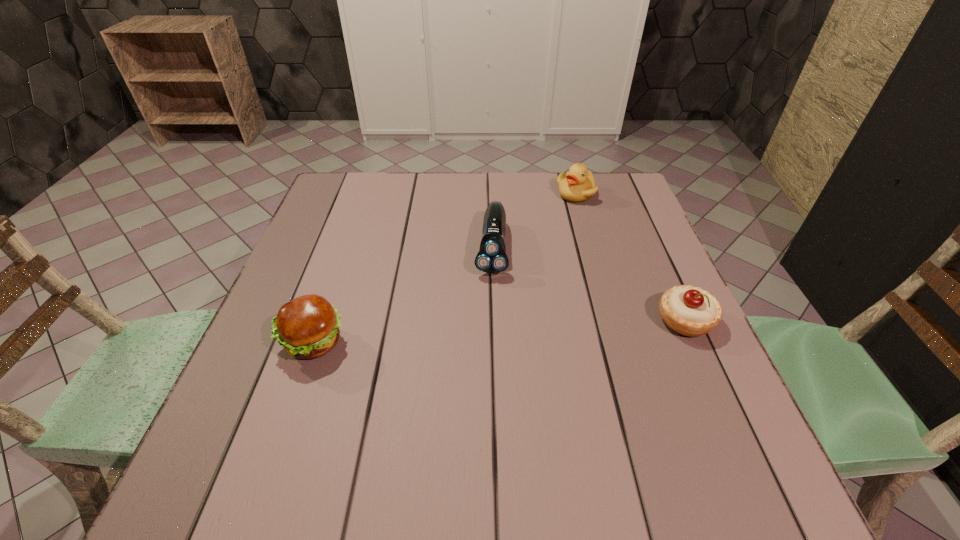
Find the location of `vacant point located between the leftmost object and the rightmost object`. vacant point located between the leftmost object and the rightmost object is located at coordinates (499, 332).

Where is `free spot between the rightmost object and the second object from left to right`? Image resolution: width=960 pixels, height=540 pixels. free spot between the rightmost object and the second object from left to right is located at coordinates (588, 284).

What are the coordinates of `free point between the second object from right to left and the third nearest object` in the screenshot? It's located at (533, 221).

The height and width of the screenshot is (540, 960). I want to click on vacant area that lies between the third object from right to left and the farthest object, so click(x=533, y=221).

Where is `vacant space that's between the leftmost object and the rightmost object`? This screenshot has height=540, width=960. vacant space that's between the leftmost object and the rightmost object is located at coordinates (499, 332).

Locate which object is the closest to the leftmost object. Please provide its 2D coordinates. Your answer should be formatted as a tuple, i.e. [(x, y)], where the tuple contains the x and y coordinates of a point satisfying the conditions above.

[(492, 258)]

Identify which object is the second closest to the rightmost object. Please provide its 2D coordinates. Your answer should be formatted as a tuple, i.e. [(x, y)], where the tuple contains the x and y coordinates of a point satisfying the conditions above.

[(578, 184)]

Where is `vacant space that satisfies the following two spatial constraints: 1. on the back side of the leftmost object; 2. on the right side of the third nearest object`? This screenshot has height=540, width=960. vacant space that satisfies the following two spatial constraints: 1. on the back side of the leftmost object; 2. on the right side of the third nearest object is located at coordinates (347, 247).

Identify the location of vacant area in the image that satisfies the following two spatial constraints: 1. on the back side of the duckling; 2. on the left side of the hamburger. This screenshot has width=960, height=540. (366, 194).